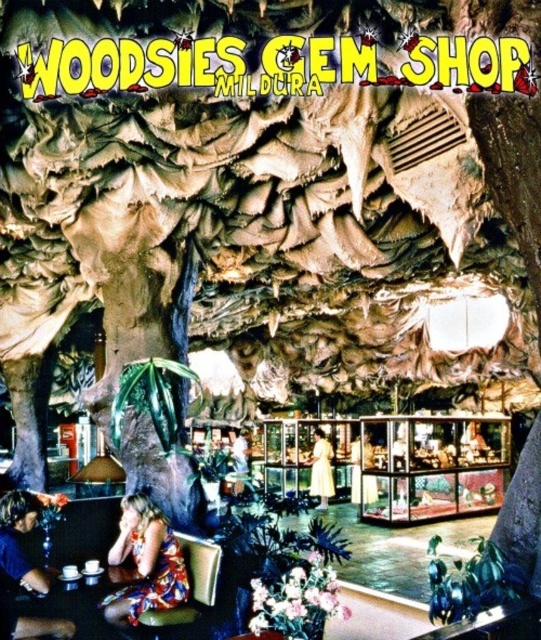
Is printed fabric dress at lower center taller than blonde hair at lower left?

Incorrect, printed fabric dress at lower center's height is not larger of blonde hair at lower left's.

Is point (131, 499) farther from viewer compared to point (0, 536)?

Yes, point (131, 499) is behind point (0, 536).

Describe the element at coordinates (144, 563) in the screenshot. I see `printed fabric dress at lower center` at that location.

Locate an element on the screen. The image size is (541, 640). printed fabric dress at lower center is located at coordinates (144, 563).

Between matte white dress at center and white cotton shirt at center, which one has more height?

With more height is matte white dress at center.

Who is more distant from viewer, (366, 486) or (237, 436)?

The point (237, 436) is more distant.

Image resolution: width=541 pixels, height=640 pixels. In order to click on matte white dress at center in this screenshot , I will do `click(359, 464)`.

Can you confirm if blonde hair at lower left is smaller than white cotton shirt at center?

Actually, blonde hair at lower left might be larger than white cotton shirt at center.

Is blonde hair at lower left in front of white cotton shirt at center?

Yes, it is.

Between point (3, 497) and point (240, 429), which one is positioned in front?

Point (3, 497) is more forward.

This screenshot has height=640, width=541. Identify the location of blonde hair at lower left. (23, 572).